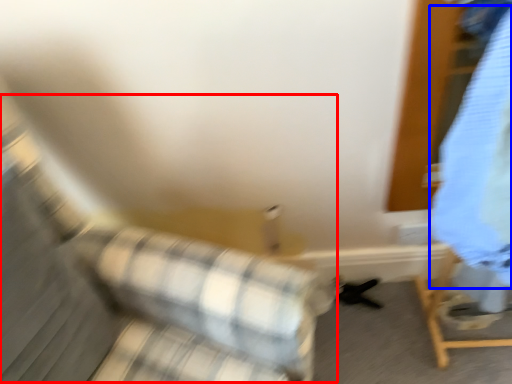
Question: Which object appears closest to the camera in this image, couch (highlighted by a red box) or clothing (highlighted by a blue box)?

Choices:
 (A) couch
 (B) clothing

Answer: (A)